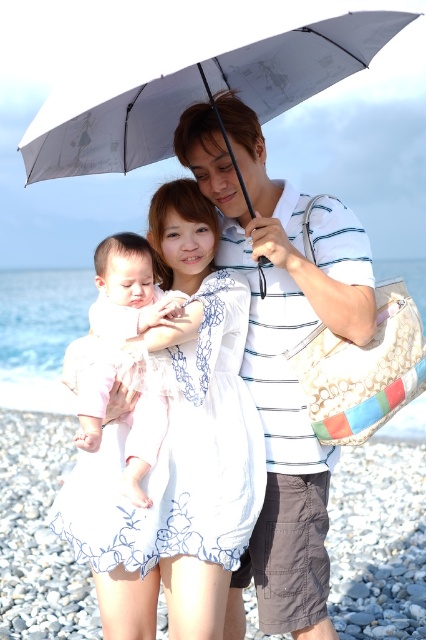
You are a photographer trying to capture a candid shot of the family. You notice the white striped polo shirt at center and the gray fabric umbrella at upper center. Which object should you focus on first if you want to ensure both are in the frame without adjusting your camera angle?

The white striped polo shirt at center is taller than the gray fabric umbrella at upper center, so focusing on the taller white striped polo shirt at center first will ensure both are in the frame without needing to adjust the camera angle.

You are a photographer trying to capture a candid shot of the family. You want to ensure the light pink fabric baby at center is in focus while the white striped polo shirt at center is slightly blurred in the background. Which part of the scene should you focus on to achieve this effect?

To focus on the light pink fabric baby at center while blurring the white striped polo shirt at center, you should focus on the light pink fabric baby at center since it is closer to the camera than the white striped polo shirt at center.